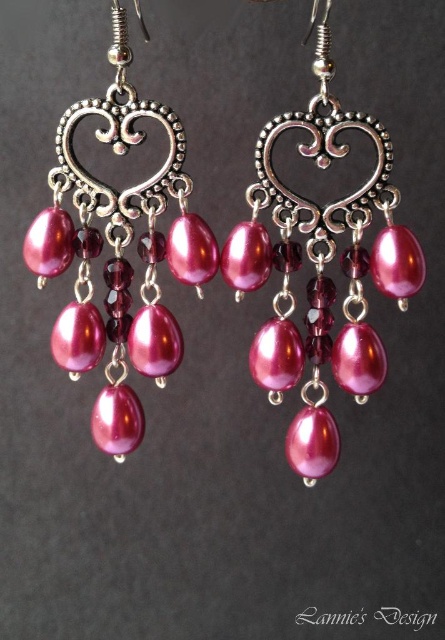
How far apart are pink pearl earrings at center and pearl-like pink earrings at center?

pink pearl earrings at center and pearl-like pink earrings at center are 7.37 inches apart.

Is pink pearl earrings at center to the left of pearl-like pink earrings at center from the viewer's perspective?

In fact, pink pearl earrings at center is to the right of pearl-like pink earrings at center.

Which is behind, point (327, 243) or point (106, 371)?

The point (106, 371) is behind.

Identify the location of pink pearl earrings at center. (322, 269).